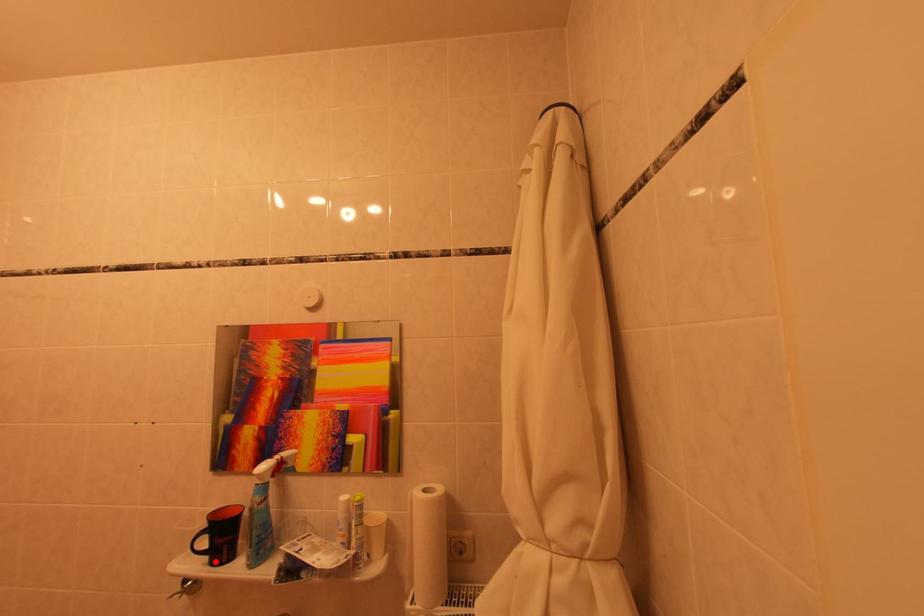
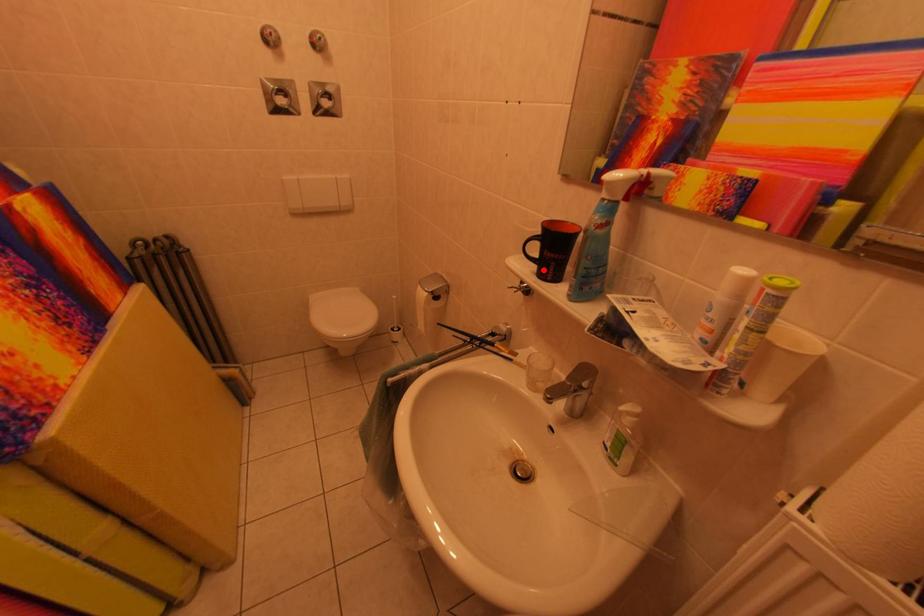
I am providing you with two images of the same scene from different viewpoints. A red point is marked on the first image and another point is marked on the second image. Does the point marked in image1 correspond to the same location as the one in image2?

Yes